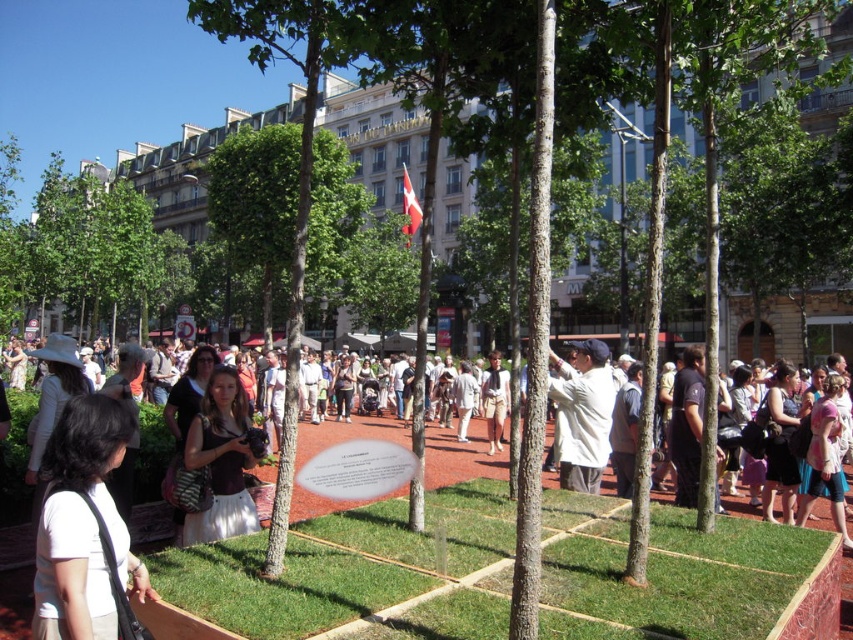
You are a GUI agent. You are given a task and a screenshot of the screen. Output one action in this format:
    pyautogui.click(x=<x>, y=<y>)
    Task: Click on the green grass at center
    Image resolution: width=853 pixels, height=640 pixels.
    Given the screenshot: What is the action you would take?
    pyautogui.click(x=334, y=564)

Who is positioned more to the right, brown leather purse at center or white cotton shirt at center?

Positioned to the right is white cotton shirt at center.

Is brown leather purse at center positioned at the back of white cotton shirt at center?

No, it is in front of white cotton shirt at center.

Is point (209, 528) farther from camera compared to point (602, 348)?

That is False.

The image size is (853, 640). Identify the location of brown leather purse at center. (221, 460).

Can you confirm if white fabric bag at lower left is taller than white cotton shirt at center?

In fact, white fabric bag at lower left may be shorter than white cotton shirt at center.

Does white fabric bag at lower left have a greater width compared to white cotton shirt at center?

Incorrect, white fabric bag at lower left's width does not surpass white cotton shirt at center's.

Which is in front, point (106, 540) or point (554, 397)?

Point (106, 540) is more forward.

The width and height of the screenshot is (853, 640). I want to click on white fabric bag at lower left, so click(x=84, y=525).